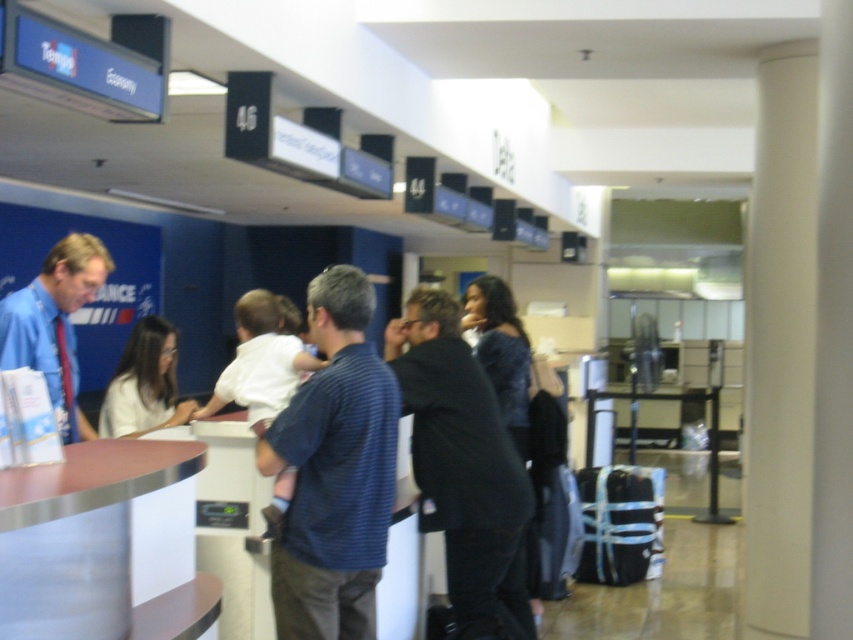
You are a passenger trying to find the Delta 46 counter. You see a black matte jacket at center and a blue shirt at left. Which direction should you look to find the overhead signs indicating the airline counters?

The overhead signs are above the counters, so you should look upwards. Since the black matte jacket at center is positioned under the blue shirt at left, the blue shirt at left is above the black matte jacket at center, meaning the overhead signs are likely above the blue shirt at left area. Look upward towards the blue shirt at left direction to find the Delta 46 counter signs.

In the scene shown: You are a photographer standing in the airport checkin area. You want to take a photo of the black matte jacket at center and the blue shirt at left. Which one should you focus on first if you want to capture both in a single frame without moving the camera?

The black matte jacket at center is taller than the blue shirt at left, so you should focus on the black matte jacket at center first to ensure it is in clear view before adjusting for the blue shirt at left.